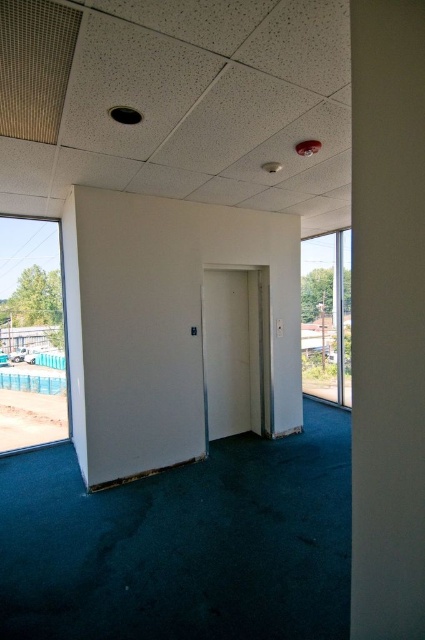
Question: Which object is positioned closest to the white smooth pillar at right?

Choices:
 (A) transparent glass window at left
 (B) transparent glass window at right

Answer: (B)

Question: Does white smooth pillar at right appear on the left side of transparent glass window at left?

Choices:
 (A) yes
 (B) no

Answer: (B)

Question: Considering the real-world distances, which object is closest to the white smooth pillar at right?

Choices:
 (A) transparent glass window at right
 (B) white matte door at center

Answer: (B)

Question: Can you confirm if transparent glass window at left is wider than blue plastic pool at lower left?

Choices:
 (A) yes
 (B) no

Answer: (A)

Question: Estimate the real-world distances between objects in this image. Which object is closer to the blue plastic pool at lower left?

Choices:
 (A) white matte door at center
 (B) white smooth pillar at right
 (C) transparent glass window at right

Answer: (C)

Question: Is white smooth pillar at right thinner than transparent glass window at right?

Choices:
 (A) no
 (B) yes

Answer: (B)